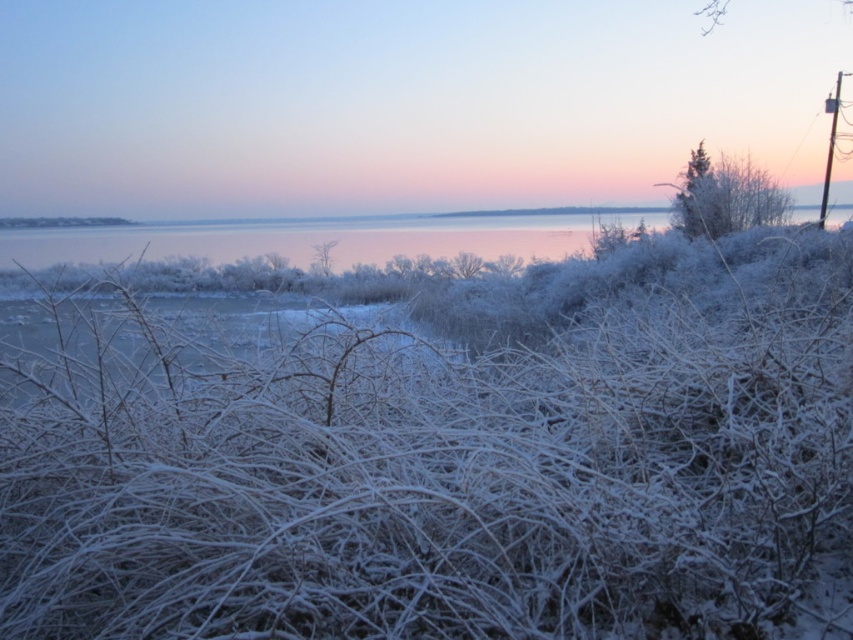
You are a photographer trying to capture the frosted white grass at center in your shot. Based on its coordinates, where should you position your camera to ensure it is centered in the frame?

The frosted white grass at center is located at point coordinates, so positioning the camera directly facing that coordinate will ensure it is centered in the frame.

You are standing in the winter landscape and want to cross from the frosted white grass at center to the silvery reflective water at center. Which direction should you move to reach the water?

The frosted white grass at center is positioned on the right side of silvery reflective water at center, so you should move to the left to reach the water.

You are standing in the winter landscape and want to walk from the point at coordinates (276, 522) to the point at coordinates (270, 225). Since both points are in the image, which point is closer to you as you stand here?

The point at coordinates (276, 522) is closer to you than the point at coordinates (270, 225) because it is nearer in the image.